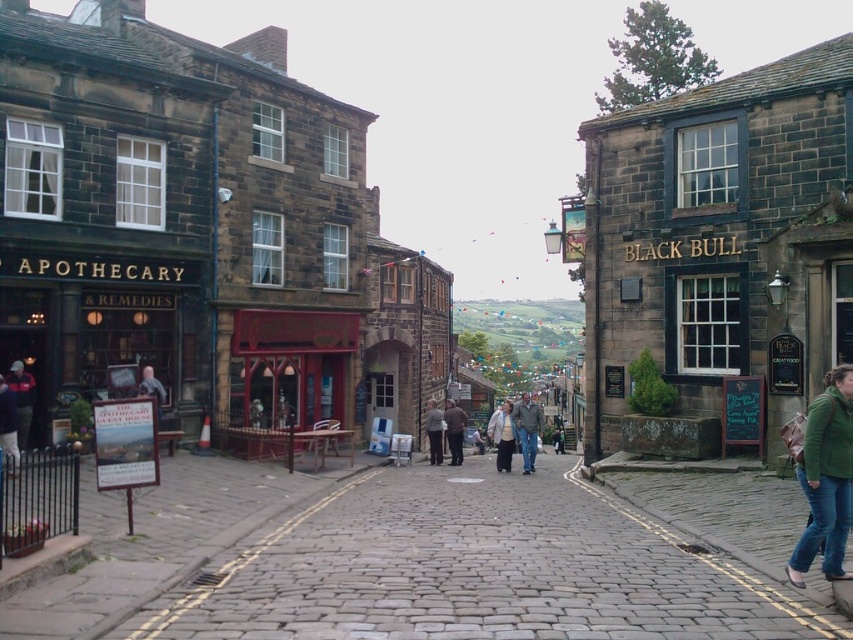
You are a tourist walking down the cobblestone street and notice two dark gray outerwear items at the center of the scene. Which one is closer to you, the dark gray jacket at center or the dark gray fabric coat at center?

The dark gray jacket at center is closer to you because it is in front of the dark gray fabric coat at center.

Based on the photo, you are standing at the center of the cobblestone street. There is a red wooden shop at center. Where is the red wooden shop located in relation to the center of the street?

The red wooden shop at center is located exactly at the center of the street, as its position is at point (289, 368), which corresponds to the central coordinates.